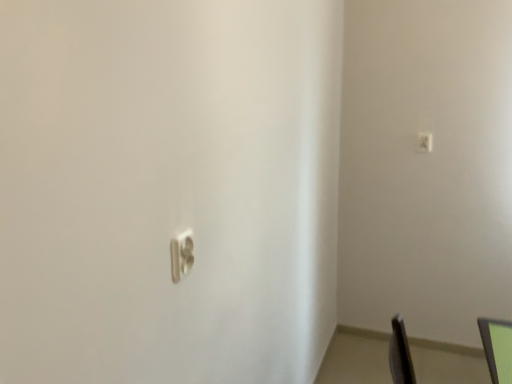
Question: Can you confirm if green matte monitor at lower right is smaller than satin silver switch at upper right, the 2th light switch in the bottom-to-top sequence?

Choices:
 (A) yes
 (B) no

Answer: (B)

Question: Is green matte monitor at lower right bigger than satin silver switch at upper right, the 2th light switch in the bottom-to-top sequence?

Choices:
 (A) no
 (B) yes

Answer: (B)

Question: From a real-world perspective, is green matte monitor at lower right physically below satin silver switch at upper right, the 2th light switch in the bottom-to-top sequence?

Choices:
 (A) yes
 (B) no

Answer: (A)

Question: From a real-world perspective, is green matte monitor at lower right located higher than satin silver switch at upper right, the 2th light switch in the bottom-to-top sequence?

Choices:
 (A) no
 (B) yes

Answer: (A)

Question: Is green matte monitor at lower right at the right side of satin silver switch at upper right, the 2th light switch when ordered from front to back?

Choices:
 (A) no
 (B) yes

Answer: (A)

Question: Based on their sizes in the image, would you say white plastic light switch at center, the 1th light switch when ordered from left to right, is bigger or smaller than satin silver switch at upper right, which is the 1th light switch in right-to-left order?

Choices:
 (A) big
 (B) small

Answer: (A)

Question: Is point (177, 254) positioned closer to the camera than point (419, 150)?

Choices:
 (A) closer
 (B) farther

Answer: (A)

Question: Is white plastic light switch at center, the 1th light switch when ordered from left to right, in front of or behind satin silver switch at upper right, the 2th light switch in the bottom-to-top sequence, in the image?

Choices:
 (A) front
 (B) behind

Answer: (A)

Question: From a real-world perspective, is white plastic light switch at center, arranged as the 2th light switch when viewed from the right, positioned above or below satin silver switch at upper right, the 2th light switch when ordered from front to back?

Choices:
 (A) above
 (B) below

Answer: (B)

Question: Considering the positions of white plastic light switch at center, the first light switch from the bottom, and green matte monitor at lower right in the image, is white plastic light switch at center, the first light switch from the bottom, taller or shorter than green matte monitor at lower right?

Choices:
 (A) tall
 (B) short

Answer: (A)

Question: From a real-world perspective, is white plastic light switch at center, arranged as the 2th light switch when viewed from the right, positioned above or below green matte monitor at lower right?

Choices:
 (A) below
 (B) above

Answer: (B)

Question: In terms of size, does white plastic light switch at center, the 2th light switch viewed from the top, appear bigger or smaller than green matte monitor at lower right?

Choices:
 (A) big
 (B) small

Answer: (B)

Question: In the image, is white plastic light switch at center, which ranks as the second light switch in back-to-front order, positioned in front of or behind green matte monitor at lower right?

Choices:
 (A) front
 (B) behind

Answer: (B)

Question: From a real-world perspective, is green matte monitor at lower right physically located above or below white plastic light switch at center, which ranks as the second light switch in back-to-front order?

Choices:
 (A) above
 (B) below

Answer: (B)

Question: From the image's perspective, is green matte monitor at lower right above or below white plastic light switch at center, the 1th light switch positioned from the front?

Choices:
 (A) below
 (B) above

Answer: (A)